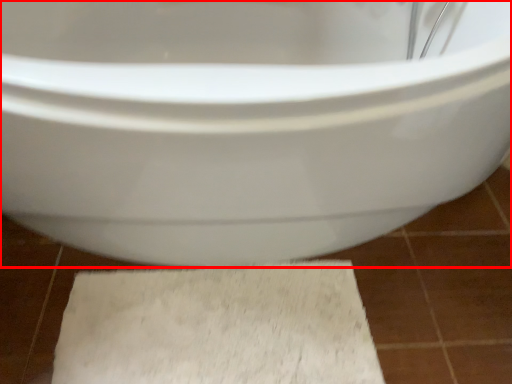
Question: From the image's perspective, what is the correct spatial positioning of toilet (annotated by the red box) in reference to bath mat?

Choices:
 (A) above
 (B) below

Answer: (A)